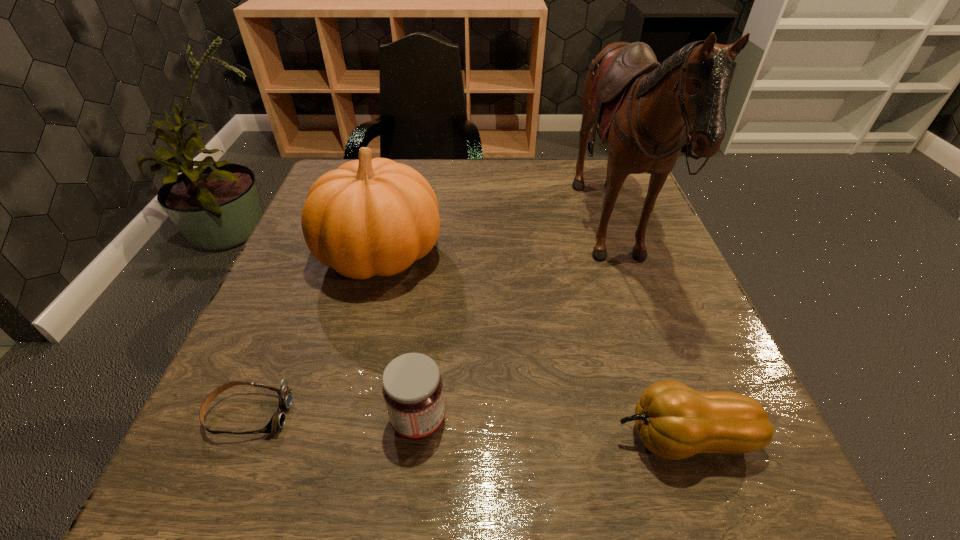
This screenshot has height=540, width=960. Find the location of `saddle that is positioned at the right edge`. saddle that is positioned at the right edge is located at coordinates (644, 109).

This screenshot has height=540, width=960. In order to click on gourd at the right edge in this screenshot , I will do `click(674, 421)`.

Find the location of a particular element. object that is at the near left corner is located at coordinates click(x=277, y=421).

Locate an element on the screen. The image size is (960, 540). object located in the far right corner section of the desktop is located at coordinates (644, 109).

You are a GUI agent. You are given a task and a screenshot of the screen. Output one action in this format:
    pyautogui.click(x=<x>, y=<y>)
    Task: Click on the object that is at the near right corner
    
    Given the screenshot: What is the action you would take?
    pyautogui.click(x=674, y=421)

Image resolution: width=960 pixels, height=540 pixels. I want to click on free space at the far edge of the desktop, so click(x=420, y=165).

Locate an element on the screen. The image size is (960, 540). vacant region at the near edge of the desktop is located at coordinates (444, 476).

Find the location of a particular element. vacant space at the left edge of the desktop is located at coordinates (300, 264).

Where is `free region at the right edge of the desktop`? The height and width of the screenshot is (540, 960). free region at the right edge of the desktop is located at coordinates (624, 228).

Image resolution: width=960 pixels, height=540 pixels. I want to click on free spot at the far right corner of the desktop, so click(x=617, y=201).